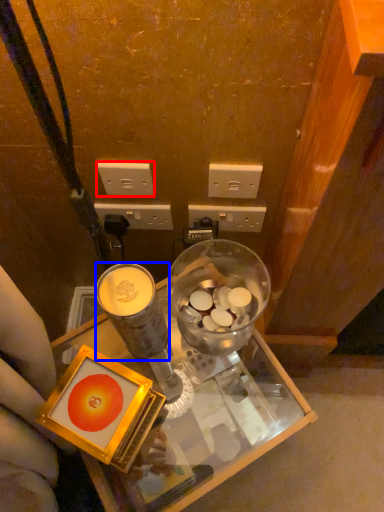
Question: Which point is further to the camera, power outlet (highlighted by a red box) or coffee cup (highlighted by a blue box)?

Choices:
 (A) power outlet
 (B) coffee cup

Answer: (A)